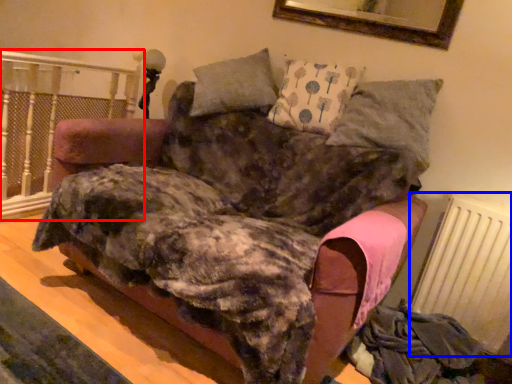
Question: Which object appears closest to the camera in this image, rail (highlighted by a red box) or radiator (highlighted by a blue box)?

Choices:
 (A) rail
 (B) radiator

Answer: (B)